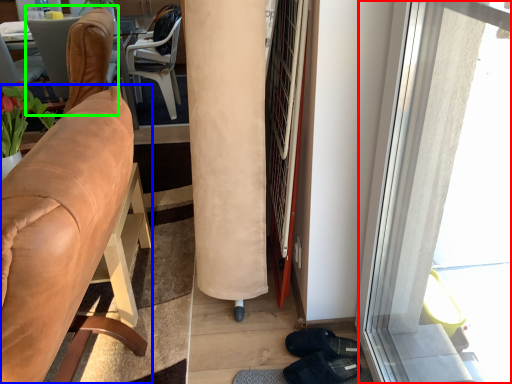
Question: Estimate the real-world distances between objects in this image. Which object is closer to window (highlighted by a red box), chair (highlighted by a blue box) or chair (highlighted by a green box)?

Choices:
 (A) chair
 (B) chair

Answer: (A)